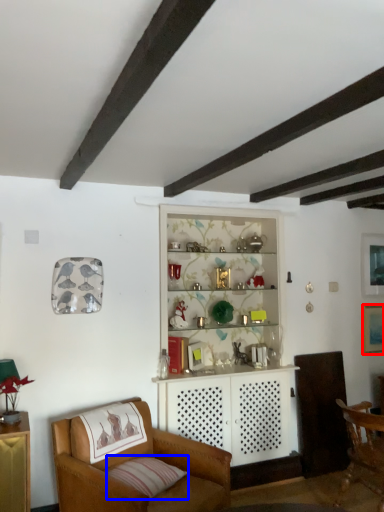
Question: Which object is further to the camera taking this photo, picture frame (highlighted by a red box) or pillow (highlighted by a blue box)?

Choices:
 (A) picture frame
 (B) pillow

Answer: (A)